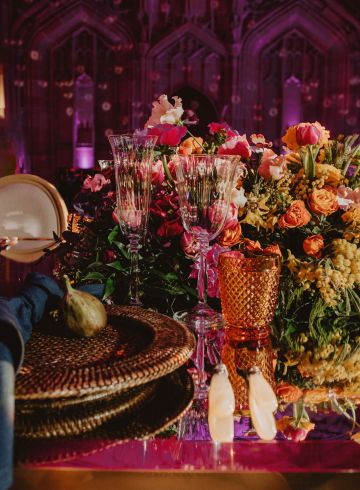
In order to click on wine glass in this screenshot , I will do pyautogui.click(x=202, y=215).